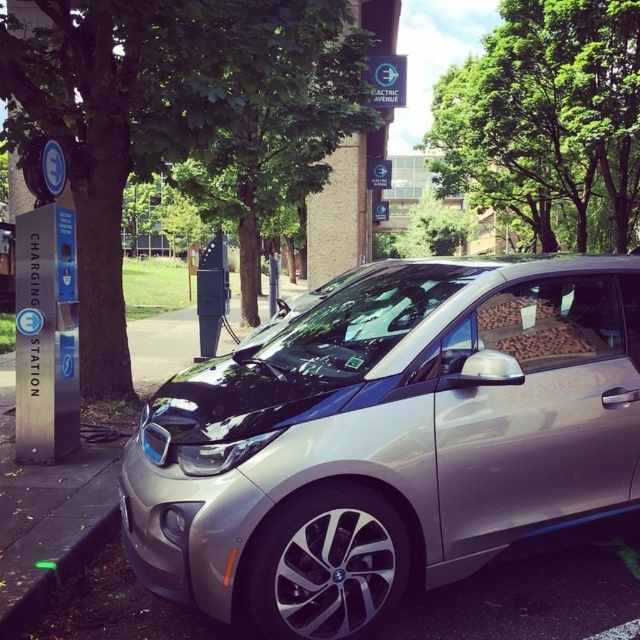
Question: Can you confirm if sleek metallic car at center is positioned below green leafy tree at center?

Choices:
 (A) yes
 (B) no

Answer: (A)

Question: Which object is the closest to the green rubber curb at lower left?

Choices:
 (A) green leafy tree at upper center
 (B) green leafy tree at center

Answer: (A)

Question: Which point is farther to the camera?

Choices:
 (A) (536, 221)
 (B) (22, 125)

Answer: (A)

Question: From the image, what is the correct spatial relationship of sleek metallic car at center in relation to green leafy tree at center?

Choices:
 (A) below
 (B) above

Answer: (A)

Question: Estimate the real-world distances between objects in this image. Which object is closer to the green leafy tree at center?

Choices:
 (A) green rubber curb at lower left
 (B) sleek metallic car at center
 (C) green leafy tree at upper center

Answer: (C)

Question: Is sleek metallic car at center bigger than green rubber curb at lower left?

Choices:
 (A) yes
 (B) no

Answer: (A)